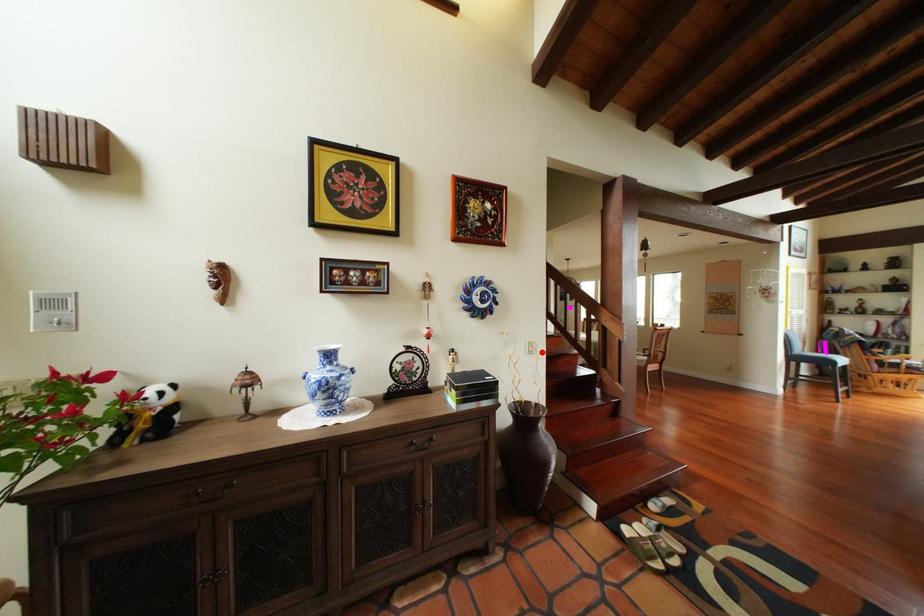
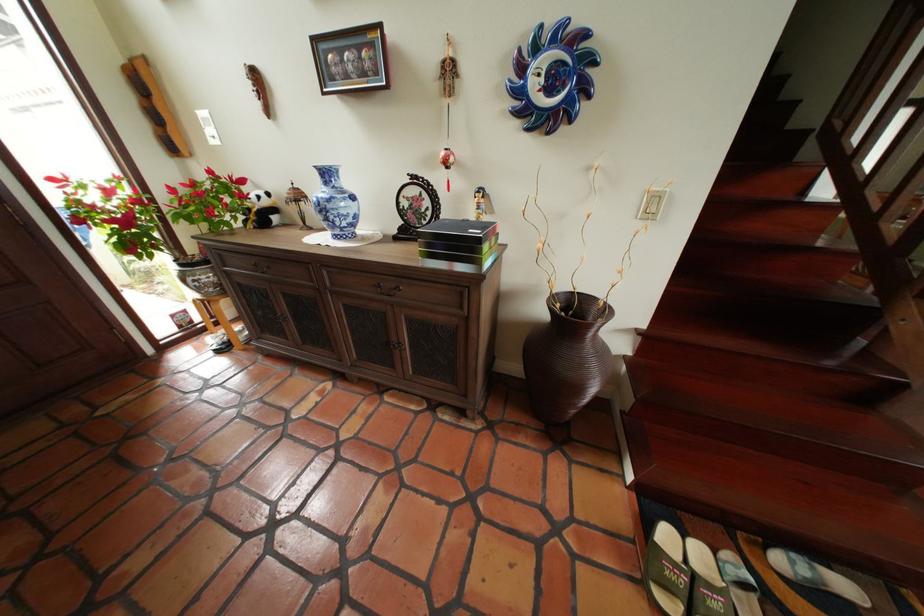
Locate, in the second image, the point that corresponds to the highlighted location in the first image.

(658, 213)